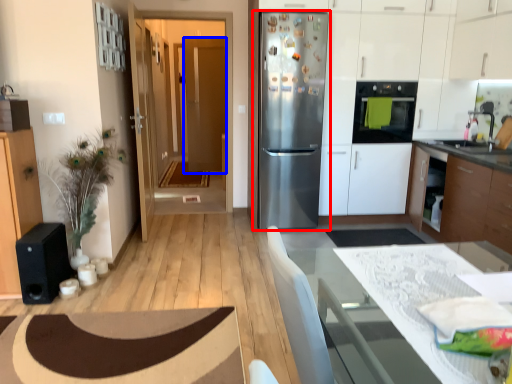
Question: Among these objects, which one is nearest to the camera, refrigerator (highlighted by a red box) or door (highlighted by a blue box)?

Choices:
 (A) refrigerator
 (B) door

Answer: (A)